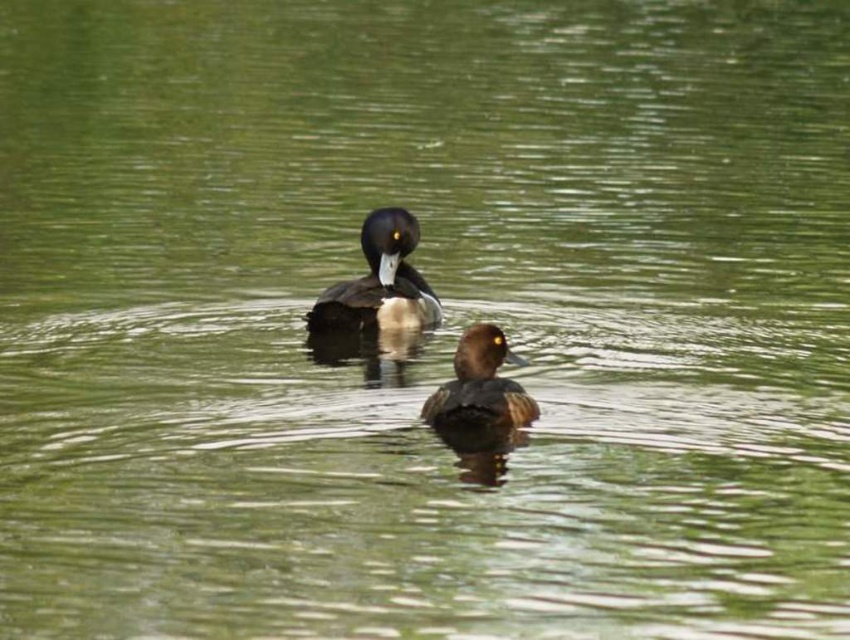
What are the coordinates of `shiny black duck at center` in the screenshot? It's located at (380, 282).